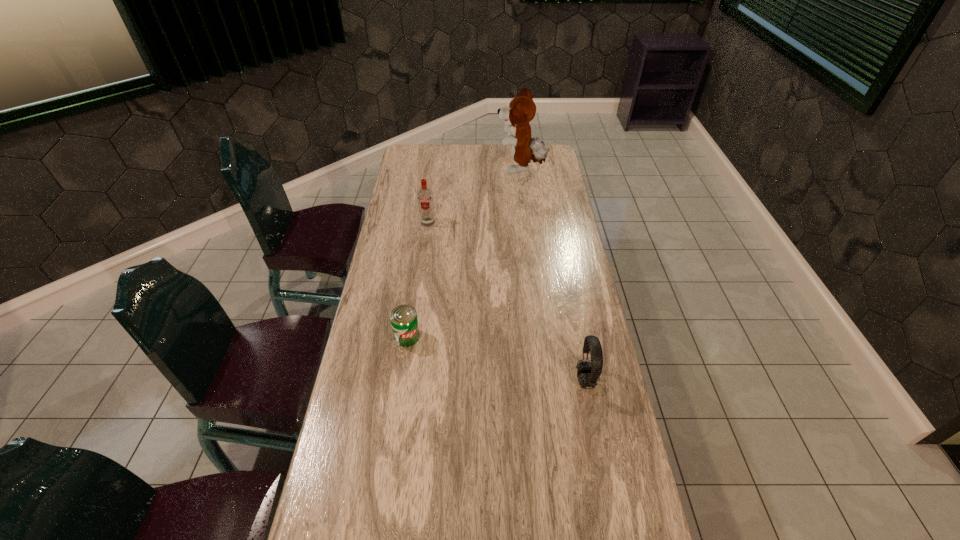
This screenshot has width=960, height=540. Find the location of `free spot that satisfies the following two spatial constraints: 1. on the face of the farthest object; 2. on the front side of the can`. free spot that satisfies the following two spatial constraints: 1. on the face of the farthest object; 2. on the front side of the can is located at coordinates 540,336.

The width and height of the screenshot is (960, 540). I want to click on vacant region that satisfies the following two spatial constraints: 1. on the face of the farthest object; 2. on the front side of the can, so click(540, 336).